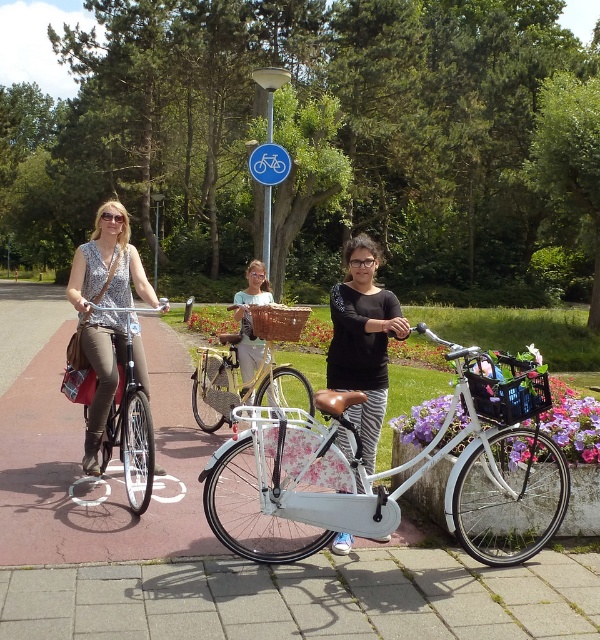
Question: Is black jersey at center to the left of yellow matte bicycle at center from the viewer's perspective?

Choices:
 (A) no
 (B) yes

Answer: (A)

Question: Can you confirm if matte black tank top at center is wider than yellow matte bicycle at center?

Choices:
 (A) yes
 (B) no

Answer: (A)

Question: Which object is closer to the camera taking this photo?

Choices:
 (A) white glossy bicycle at center
 (B) light blue fabric shirt at center

Answer: (A)

Question: Which point is farther to the camera?

Choices:
 (A) black jersey at center
 (B) gray concrete pavement at lower center

Answer: (A)

Question: Which point appears closest to the camera in this image?

Choices:
 (A) (106, 356)
 (B) (250, 384)
 (C) (235, 298)
 (D) (283, 168)

Answer: (A)

Question: Can you confirm if matte black tank top at center is thinner than light blue fabric shirt at center?

Choices:
 (A) yes
 (B) no

Answer: (B)